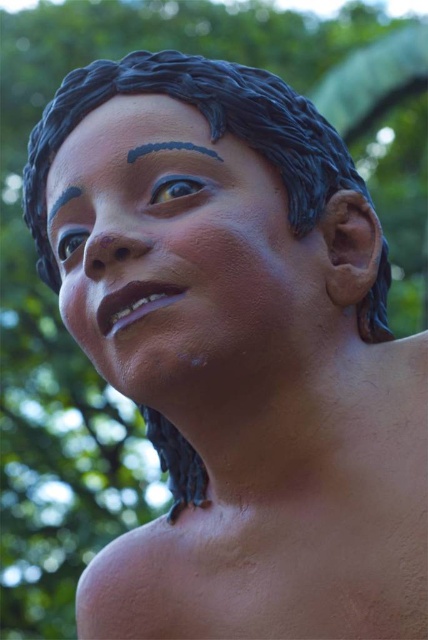
Between matte clay neck at center and matte black forehead at upper center, which one has less height?

Standing shorter between the two is matte black forehead at upper center.

Who is more forward, (412, 419) or (189, 112)?

Positioned in front is point (412, 419).

You are a GUI agent. You are given a task and a screenshot of the screen. Output one action in this format:
    pyautogui.click(x=<x>, y=<y>)
    Task: Click on the matte clay neck at center
    The image size is (428, 640).
    Given the screenshot: What is the action you would take?
    pyautogui.click(x=288, y=513)

Is blue matte eyebrow at upper center closer to the viewer compared to black matte eyebrow at upper left?

That is True.

Does point (162, 141) come behind point (62, 196)?

That is False.

The width and height of the screenshot is (428, 640). What are the coordinates of `blue matte eyebrow at upper center` in the screenshot? It's located at (169, 148).

Does matte clay neck at center appear over blue matte eyebrow at upper center?

Actually, matte clay neck at center is below blue matte eyebrow at upper center.

Is matte clay neck at center smaller than blue matte eyebrow at upper center?

Actually, matte clay neck at center might be larger than blue matte eyebrow at upper center.

Who is more distant from viewer, [327,538] or [216,160]?

Positioned behind is point [216,160].

Where is `matte clay neck at center`? matte clay neck at center is located at coordinates (288, 513).